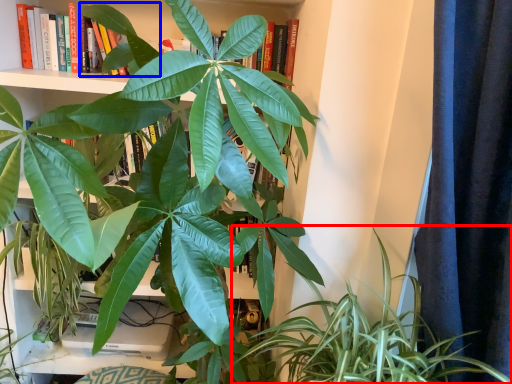
Question: Among these objects, which one is nearest to the camera, houseplant (highlighted by a red box) or leaf (highlighted by a blue box)?

Choices:
 (A) houseplant
 (B) leaf

Answer: (A)